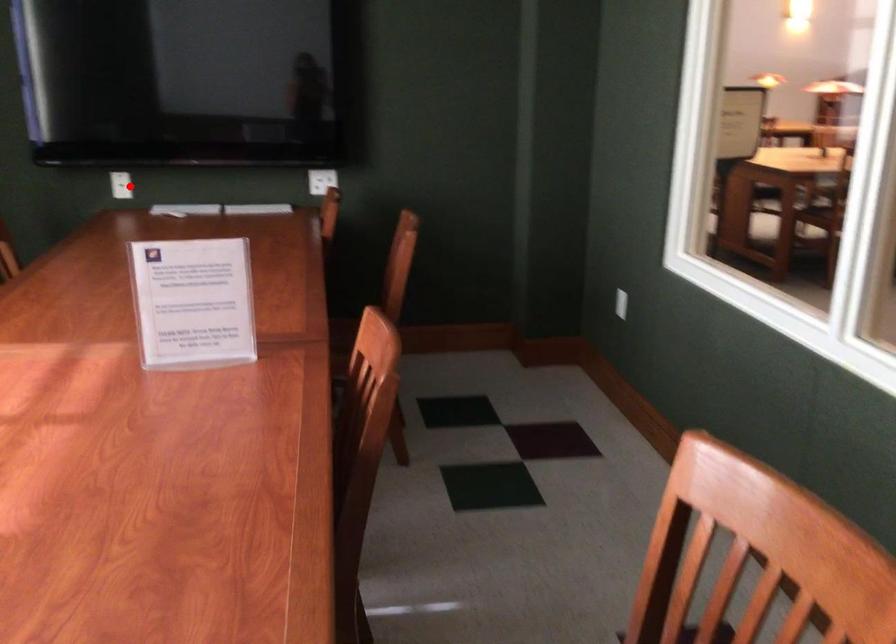
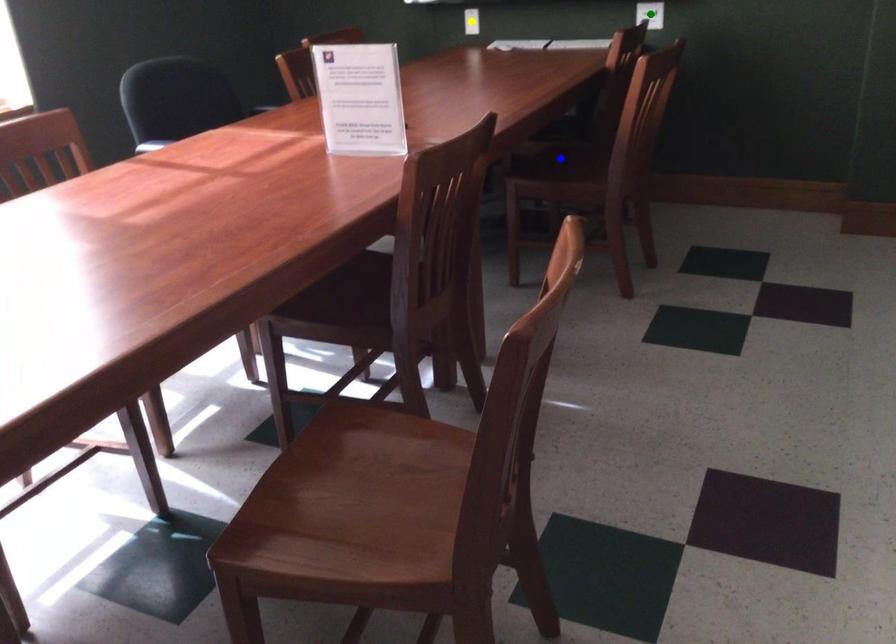
Question: I am providing you with two images of the same scene from different viewpoints. A red point is marked on the first image. You are given multiple points on the second image. Can you choose the point in image 2 that corresponds to the point in image 1?

Choices:
 (A) yellow point
 (B) green point
 (C) blue point

Answer: (A)